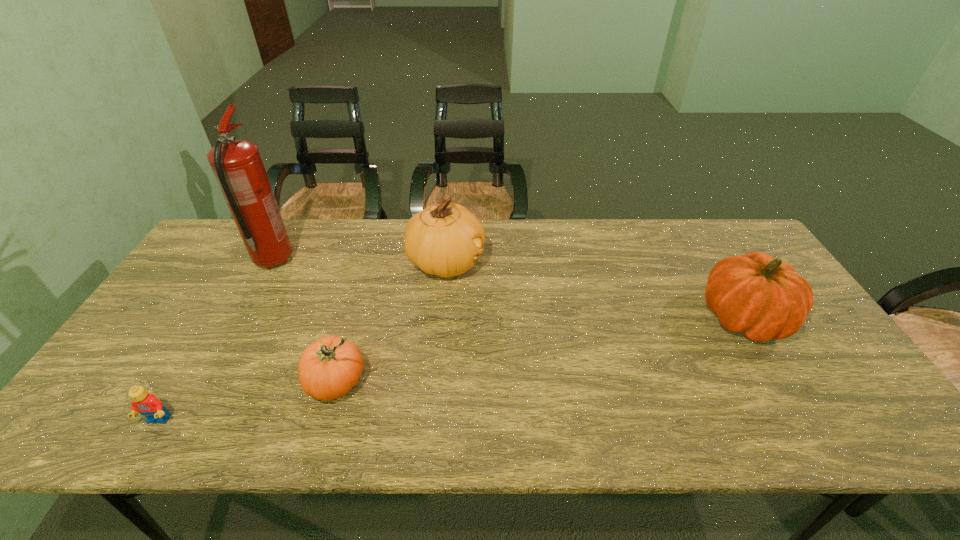
Locate an element on the screen. fire extinguisher is located at coordinates (237, 165).

I want to click on the second object from right to left, so click(x=444, y=240).

Find the location of a particular element. This screenshot has width=960, height=540. the rightmost object is located at coordinates (763, 298).

Locate an element on the screen. The height and width of the screenshot is (540, 960). the second nearest object is located at coordinates (328, 368).

Locate an element on the screen. the leftmost pumpkin is located at coordinates (328, 368).

Where is `Lego`? Lego is located at coordinates (145, 403).

Locate an element on the screen. This screenshot has height=540, width=960. the nearest object is located at coordinates (145, 403).

Image resolution: width=960 pixels, height=540 pixels. What are the coordinates of `vacant point located on the handle side the fire extinguisher` in the screenshot? It's located at (296, 221).

At what (x,y) coordinates should I click in order to perform the action: click on blank space located 0.140m on the handle side the fire extinguisher. Please return your answer as a coordinate pair (x, y). The image size is (960, 540). Looking at the image, I should click on (297, 219).

This screenshot has height=540, width=960. Find the location of `vacant space located 0.060m on the handle side the fire extinguisher`. vacant space located 0.060m on the handle side the fire extinguisher is located at coordinates (289, 233).